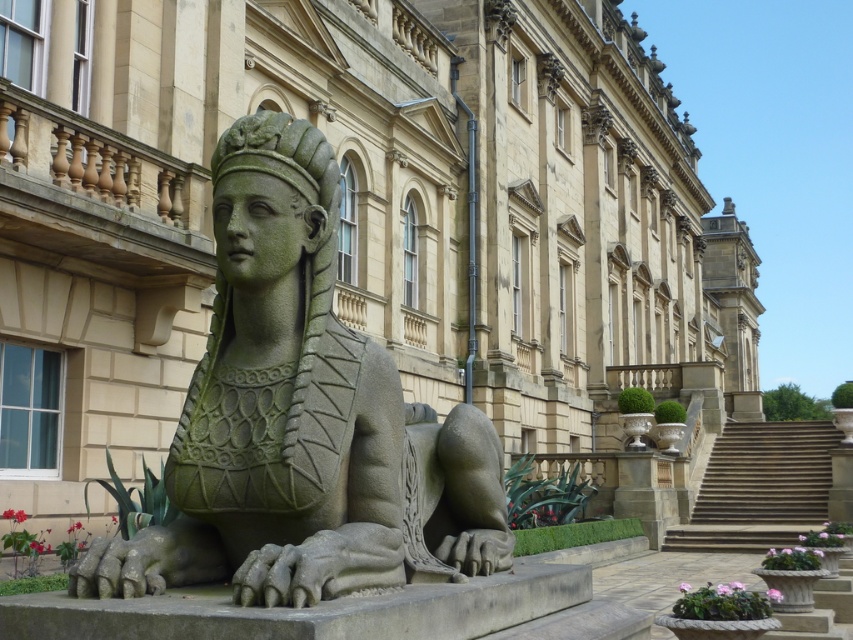
Question: Which of the following is the farthest from the observer?

Choices:
 (A) (219, 298)
 (B) (712, 497)

Answer: (B)

Question: Is green stone sphinx at center above stone stairs at center?

Choices:
 (A) yes
 (B) no

Answer: (A)

Question: Is green stone sphinx at center to the left of stone stairs at center from the viewer's perspective?

Choices:
 (A) yes
 (B) no

Answer: (A)

Question: Which of the following is the farthest from the observer?

Choices:
 (A) (178, 483)
 (B) (740, 547)

Answer: (B)

Question: Which object is farther from the camera taking this photo?

Choices:
 (A) stone stairs at center
 (B) green stone sphinx at center

Answer: (A)

Question: In this image, where is green stone sphinx at center located relative to stone stairs at center?

Choices:
 (A) above
 (B) below

Answer: (A)